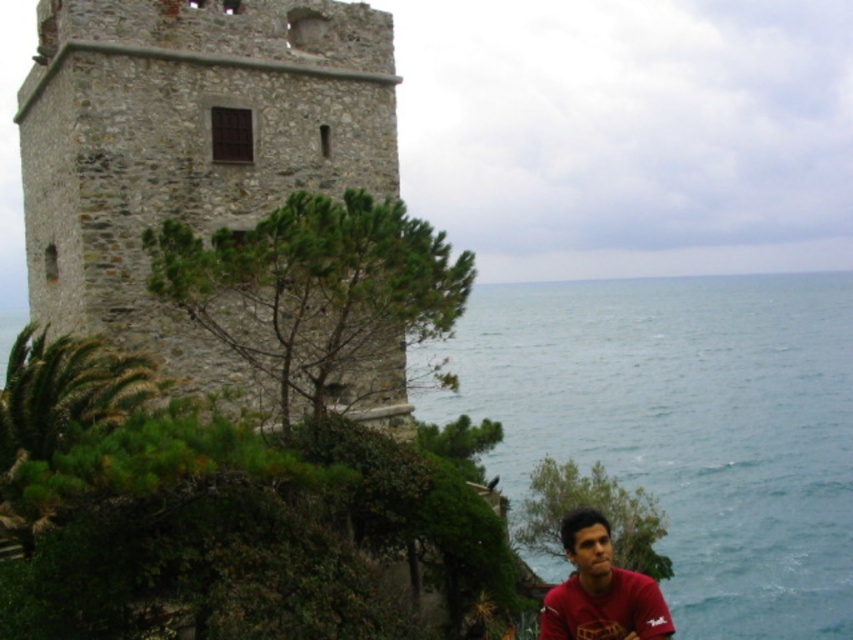
You are standing at the cliff edge near the historic stone tower and want to take a photo of the two points marked in the scene. Which point should you focus on first if you want to capture both points in a single frame without moving your camera? Please choose between point (608,465) and point (346,12).

You should focus on point (346,12) first because point (608,465) is behind it, so keeping the closer point in focus will ensure both are visible in the frame.

You are standing at the cliff edge near the historic stone tower and see the blue water at lower right and the matte red shirt at lower right. Which object appears taller from your viewpoint?

The blue water at lower right appears taller than the matte red shirt at lower right because the description states that the blue water at lower right is much taller as matte red shirt at lower right.